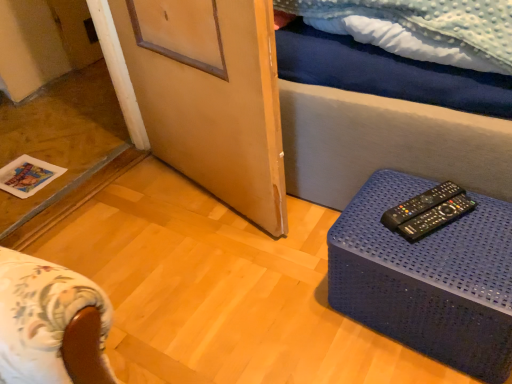
Identify the location of vacant point to the left of black plastic remote controls at right, arranged as the 2th remote control when viewed from the back. This screenshot has width=512, height=384. (372, 231).